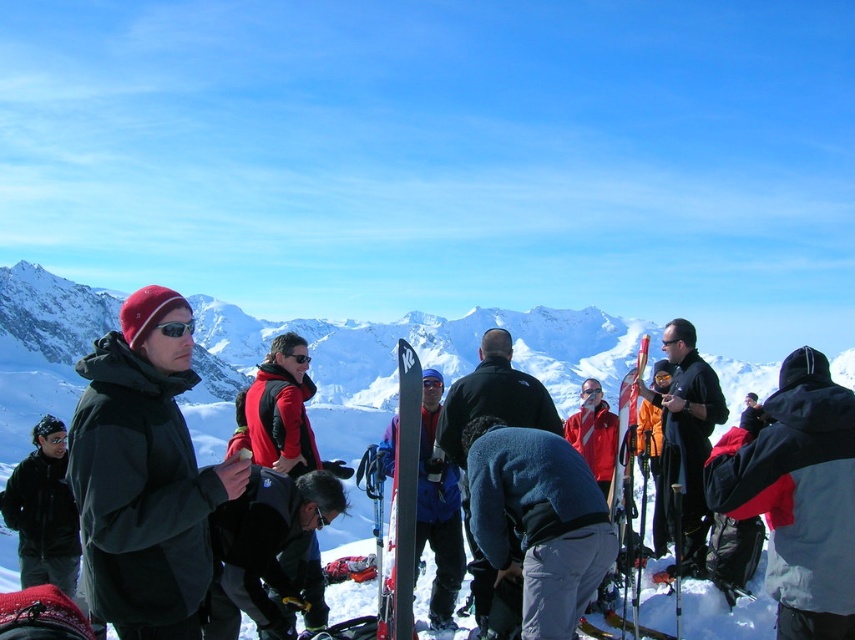
Question: Which of the following is the farthest from the observer?

Choices:
 (A) (166, 326)
 (B) (142, 378)
 (C) (694, 529)
 (D) (812, 484)

Answer: (C)

Question: Is red jacket at center smaller than orange metallic ski at center?

Choices:
 (A) yes
 (B) no

Answer: (A)

Question: Which point appears farthest from the camera in this image?

Choices:
 (A) (558, 595)
 (B) (305, 349)

Answer: (B)

Question: Among these objects, which one is farthest from the camera?

Choices:
 (A) black matte goggles at center
 (B) sunglasses at center
 (C) red jacket at center

Answer: (A)

Question: Is black matte jacket at center positioned in front of orange metallic ski at center?

Choices:
 (A) no
 (B) yes

Answer: (A)

Question: Does orange metallic ski at center have a smaller size compared to sunglasses at center?

Choices:
 (A) yes
 (B) no

Answer: (B)